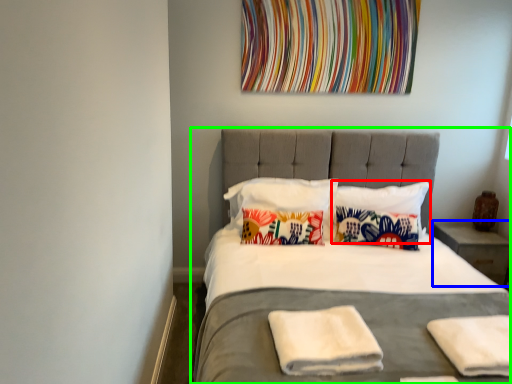
Question: Based on their relative distances, which object is nearer to pillow (highlighted by a red box)? Choose from nightstand (highlighted by a blue box) and bed (highlighted by a green box).

Choices:
 (A) nightstand
 (B) bed

Answer: (A)